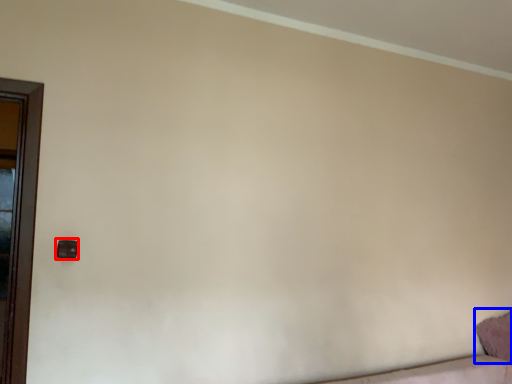
Question: Among these objects, which one is farthest to the camera, door handle (highlighted by a red box) or pillow (highlighted by a blue box)?

Choices:
 (A) door handle
 (B) pillow

Answer: (B)